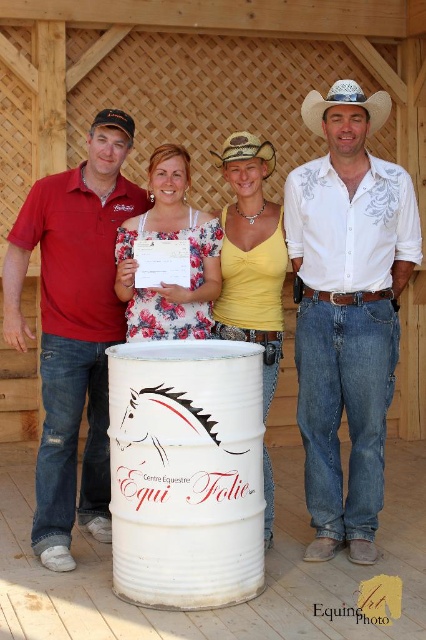
Who is taller, matte red polo shirt at left or white straw cowboy hat at upper center?

Standing taller between the two is matte red polo shirt at left.

What do you see at coordinates (74, 326) in the screenshot?
I see `matte red polo shirt at left` at bounding box center [74, 326].

The image size is (426, 640). I want to click on matte red polo shirt at left, so click(74, 326).

Where is `matte red polo shirt at left`? The width and height of the screenshot is (426, 640). matte red polo shirt at left is located at coordinates click(x=74, y=326).

Is matte red polo shirt at left smaller than yellow matte tank top at center?

Actually, matte red polo shirt at left might be larger than yellow matte tank top at center.

Is matte red polo shirt at left positioned behind yellow matte tank top at center?

That is False.

What do you see at coordinates (74, 326) in the screenshot?
I see `matte red polo shirt at left` at bounding box center [74, 326].

Where is `matte red polo shirt at left`? This screenshot has height=640, width=426. matte red polo shirt at left is located at coordinates (74, 326).

Is white matte barrel at center wider than matte red polo shirt at left?

In fact, white matte barrel at center might be narrower than matte red polo shirt at left.

What do you see at coordinates (186, 472) in the screenshot?
I see `white matte barrel at center` at bounding box center [186, 472].

Does point (144, 420) come farther from viewer compared to point (40, 540)?

No, it is not.

This screenshot has width=426, height=640. I want to click on white matte barrel at center, so click(186, 472).